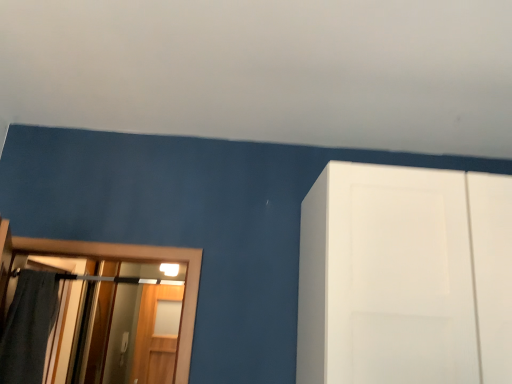
Question: From the image's perspective, is dark gray fabric bath towel at left beneath wooden screen door at left?

Choices:
 (A) no
 (B) yes

Answer: (A)

Question: Could you tell me if dark gray fabric bath towel at left is facing wooden screen door at left?

Choices:
 (A) no
 (B) yes

Answer: (A)

Question: Does dark gray fabric bath towel at left have a lesser height compared to wooden screen door at left?

Choices:
 (A) no
 (B) yes

Answer: (B)

Question: Does dark gray fabric bath towel at left touch wooden screen door at left?

Choices:
 (A) no
 (B) yes

Answer: (A)

Question: Does dark gray fabric bath towel at left contain wooden screen door at left?

Choices:
 (A) yes
 (B) no

Answer: (B)

Question: Would you say dark gray fabric bath towel at left is a long distance from wooden screen door at left?

Choices:
 (A) yes
 (B) no

Answer: (A)

Question: Is wooden screen door at left at the right side of dark gray fabric bath towel at left?

Choices:
 (A) no
 (B) yes

Answer: (B)

Question: Is wooden screen door at left taller than dark gray fabric bath towel at left?

Choices:
 (A) no
 (B) yes

Answer: (B)

Question: Considering the relative positions of wooden screen door at left and dark gray fabric bath towel at left in the image provided, is wooden screen door at left to the left of dark gray fabric bath towel at left from the viewer's perspective?

Choices:
 (A) yes
 (B) no

Answer: (B)

Question: From the image's perspective, would you say wooden screen door at left is positioned over dark gray fabric bath towel at left?

Choices:
 (A) no
 (B) yes

Answer: (A)

Question: Is wooden screen door at left looking in the opposite direction of dark gray fabric bath towel at left?

Choices:
 (A) yes
 (B) no

Answer: (B)

Question: Considering the relative sizes of wooden screen door at left and dark gray fabric bath towel at left in the image provided, is wooden screen door at left wider than dark gray fabric bath towel at left?

Choices:
 (A) no
 (B) yes

Answer: (A)

Question: From the image's perspective, relative to dark gray fabric bath towel at left, is wooden screen door at left above or below?

Choices:
 (A) above
 (B) below

Answer: (B)